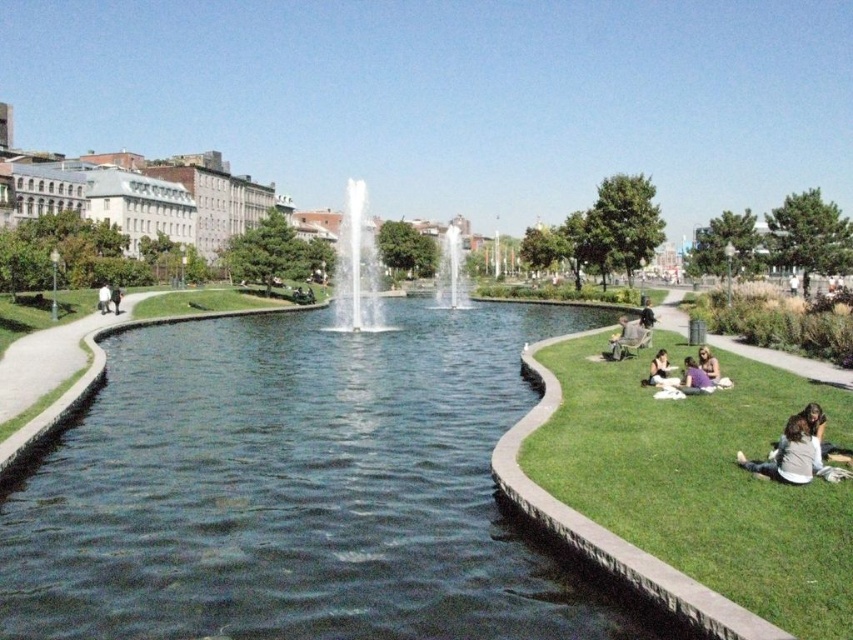
You are planning to set up a picnic blanket in the park. You see the green grass at lower right and the white fabric person at lower right. Which area has more space to accommodate your picnic blanket?

The green grass at lower right is larger in size than the white fabric person at lower right, so the green grass at lower right has more space to accommodate your picnic blanket.

You are standing at the center of the park and want to find the green grass at lower right. According to the coordinates, where should you look relative to your current position?

The green grass at lower right is located at coordinates point (703, 481), so you should look towards the lower right direction from your current position at the center of the park.

You are standing at the center of the park and want to find the green grass at lower right. According to the coordinates provided, in which direction should you walk to reach it?

The green grass at lower right is located at coordinates (703, 481). Since you are at the center, you should walk towards the lower right direction to reach it.